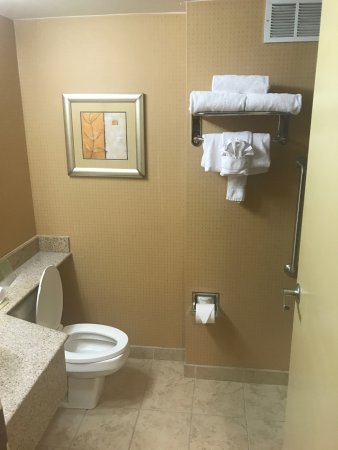
Locate an element on the screen. toilet seat lid is located at coordinates (48, 296).